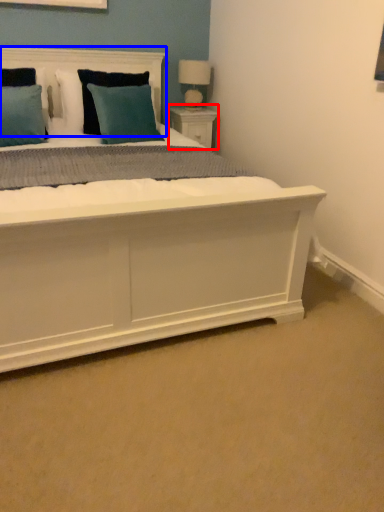
Question: Which point is closer to the camera, nightstand (highlighted by a red box) or headboard (highlighted by a blue box)?

Choices:
 (A) nightstand
 (B) headboard

Answer: (B)